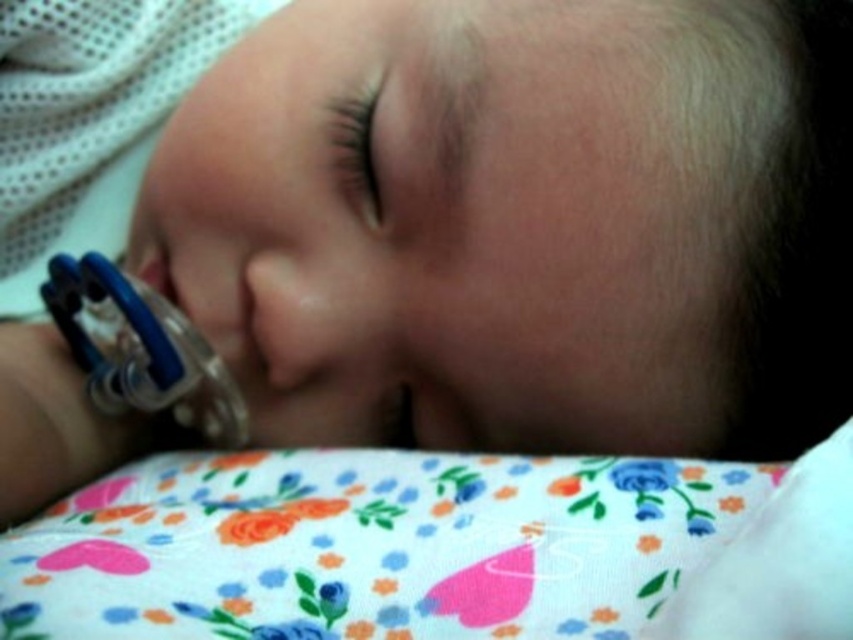
You are a caregiver checking on a sleeping baby. You see the floral fabric pillow at lower center and the blue rubber teething ring at left. Which object is positioned more to the right side of the baby?

The floral fabric pillow at lower center is positioned more to the right side of the baby than the blue rubber teething ring at left.

From the picture: You are a parent trying to place the blue rubber teething ring at left on top of the floral fabric pillow at lower center. Will it fit without falling off?

The floral fabric pillow at lower center has a lesser height compared to blue rubber teething ring at left, so placing the blue rubber teething ring at left on top of it may cause it to fall off due to the pillow being shorter in height.

You are a photographer trying to capture a clear photo of the blue rubber teething ring at left and the floral fabric pillow at lower center. Which object should you focus on to ensure it appears sharp in the photo?

The floral fabric pillow at lower center is closer to the viewer than the blue rubber teething ring at left. To ensure it appears sharp, focus on the floral fabric pillow at lower center.